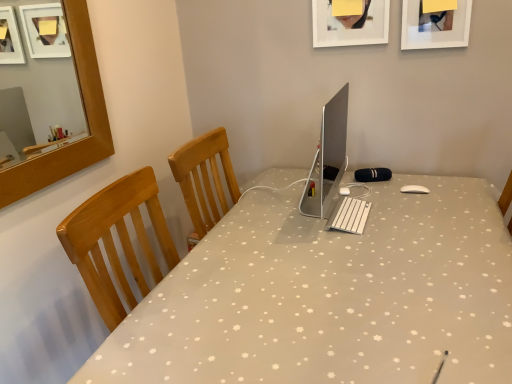
Locate an element on the screen. The width and height of the screenshot is (512, 384). free space behind silver metallic computer monitor at center is located at coordinates (298, 182).